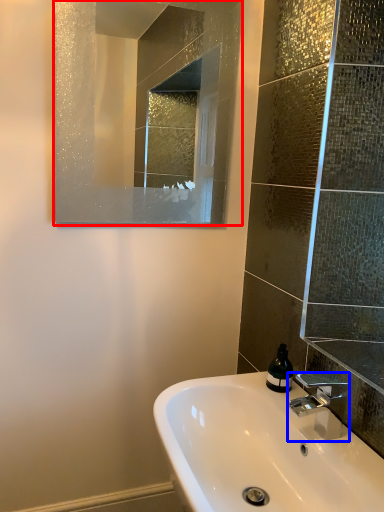
Question: Among these objects, which one is farthest to the camera, mirror (highlighted by a red box) or tap (highlighted by a blue box)?

Choices:
 (A) mirror
 (B) tap

Answer: (A)